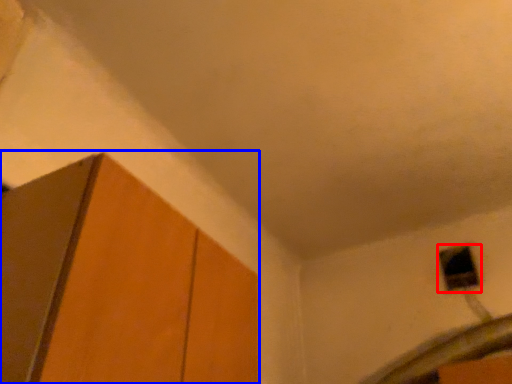
Question: Among these objects, which one is nearest to the camera, window (highlighted by a red box) or cabinetry (highlighted by a blue box)?

Choices:
 (A) window
 (B) cabinetry

Answer: (B)